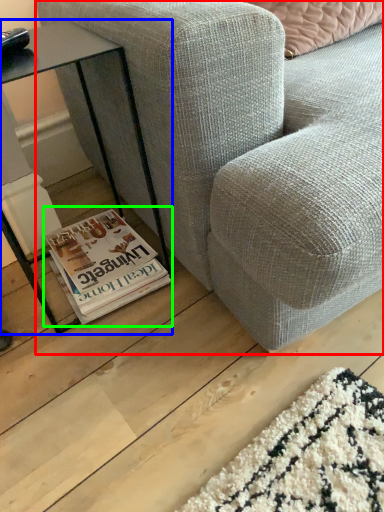
Question: Which is nearer to the studio couch (highlighted by a red box)? table (highlighted by a blue box) or paperback book (highlighted by a green box).

Choices:
 (A) table
 (B) paperback book

Answer: (A)